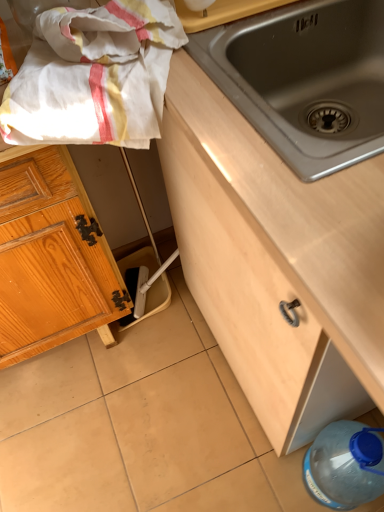
Question: Which direction should I rotate to look at wooden cabinet at center, which is counted as the 2th cabinetry, starting from the left?

Choices:
 (A) right
 (B) left

Answer: (A)

Question: Is wooden cabinet at center, which is counted as the 2th cabinetry, starting from the left, outside blue translucent bottle at lower right?

Choices:
 (A) no
 (B) yes

Answer: (B)

Question: Can you confirm if wooden cabinet at center, which is counted as the 2th cabinetry, starting from the left, is positioned to the left of blue translucent bottle at lower right?

Choices:
 (A) no
 (B) yes

Answer: (A)

Question: Can you confirm if wooden cabinet at center, which is counted as the first cabinetry, starting from the right, is thinner than blue translucent bottle at lower right?

Choices:
 (A) no
 (B) yes

Answer: (A)

Question: Is the position of wooden cabinet at center, which is counted as the 2th cabinetry, starting from the left, less distant than that of blue translucent bottle at lower right?

Choices:
 (A) yes
 (B) no

Answer: (A)

Question: Does wooden cabinet at center, which is counted as the 2th cabinetry, starting from the left, have a greater width compared to blue translucent bottle at lower right?

Choices:
 (A) yes
 (B) no

Answer: (A)

Question: Is wooden cabinet at center, which is counted as the 2th cabinetry, starting from the left, to the right of blue translucent bottle at lower right from the viewer's perspective?

Choices:
 (A) yes
 (B) no

Answer: (A)

Question: Considering the relative sizes of blue translucent bottle at lower right and white cotton towel at upper left in the image provided, is blue translucent bottle at lower right shorter than white cotton towel at upper left?

Choices:
 (A) no
 (B) yes

Answer: (A)

Question: Is blue translucent bottle at lower right located outside white cotton towel at upper left?

Choices:
 (A) no
 (B) yes

Answer: (B)

Question: Is blue translucent bottle at lower right positioned before white cotton towel at upper left?

Choices:
 (A) no
 (B) yes

Answer: (A)

Question: From the image's perspective, is blue translucent bottle at lower right below white cotton towel at upper left?

Choices:
 (A) yes
 (B) no

Answer: (A)

Question: Is blue translucent bottle at lower right in contact with white cotton towel at upper left?

Choices:
 (A) no
 (B) yes

Answer: (A)

Question: Is blue translucent bottle at lower right surrounding white cotton towel at upper left?

Choices:
 (A) yes
 (B) no

Answer: (B)

Question: Is stainless steel sink at center further to the viewer compared to blue translucent bottle at lower right?

Choices:
 (A) yes
 (B) no

Answer: (B)